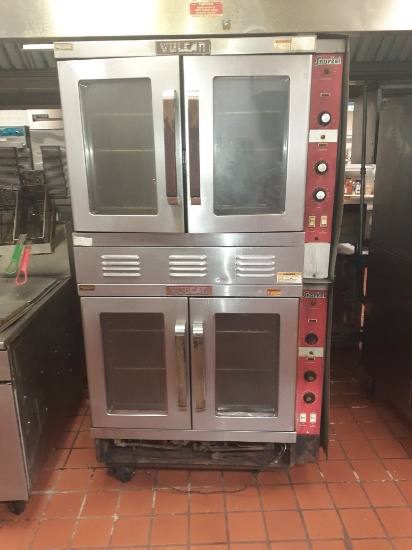
This screenshot has width=412, height=550. What are the coordinates of `oven knobs` in the screenshot? It's located at (307, 398), (308, 375), (311, 337), (322, 167), (320, 196), (325, 118).